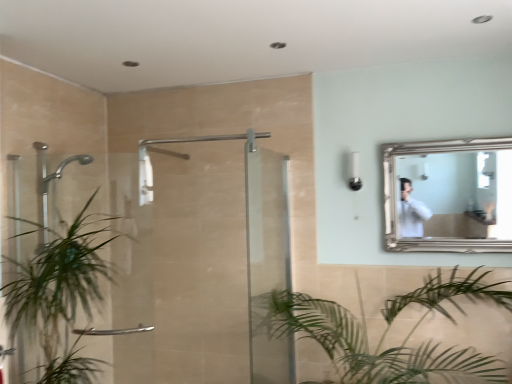
Question: Which direction should I rotate to look at green leafy plant at lower center, the 1th houseplant viewed from the right?

Choices:
 (A) right
 (B) left

Answer: (A)

Question: Is clear glass shower door at left, placed as the 1th screen door when sorted from left to right, closer to the viewer compared to silver/golden frame mirror at upper right?

Choices:
 (A) yes
 (B) no

Answer: (A)

Question: From the image's perspective, is clear glass shower door at left, placed as the 1th screen door when sorted from left to right, over silver/golden frame mirror at upper right?

Choices:
 (A) yes
 (B) no

Answer: (B)

Question: Is clear glass shower door at left, acting as the 2th screen door starting from the right, positioned behind silver/golden frame mirror at upper right?

Choices:
 (A) yes
 (B) no

Answer: (B)

Question: Is clear glass shower door at left, acting as the 2th screen door starting from the right, at the right side of silver/golden frame mirror at upper right?

Choices:
 (A) no
 (B) yes

Answer: (A)

Question: From the image's perspective, would you say clear glass shower door at left, placed as the 1th screen door when sorted from left to right, is shown under silver/golden frame mirror at upper right?

Choices:
 (A) yes
 (B) no

Answer: (A)

Question: Is clear glass shower door at left, acting as the 2th screen door starting from the right, thinner than silver/golden frame mirror at upper right?

Choices:
 (A) yes
 (B) no

Answer: (B)

Question: Considering the relative sizes of green leafy plant at lower center, the 1th houseplant viewed from the right, and green leafy plant at left, which ranks as the 1th houseplant in left-to-right order, in the image provided, is green leafy plant at lower center, the 1th houseplant viewed from the right, taller than green leafy plant at left, which ranks as the 1th houseplant in left-to-right order,?

Choices:
 (A) yes
 (B) no

Answer: (B)

Question: Can you confirm if green leafy plant at lower center, the 1th houseplant viewed from the right, is wider than green leafy plant at left, which ranks as the 1th houseplant in left-to-right order?

Choices:
 (A) no
 (B) yes

Answer: (B)

Question: Is green leafy plant at lower center, the 1th houseplant viewed from the right, in front of green leafy plant at left, placed as the second houseplant when sorted from right to left?

Choices:
 (A) no
 (B) yes

Answer: (B)

Question: From the image's perspective, would you say green leafy plant at lower center, the 1th houseplant viewed from the right, is shown under green leafy plant at left, placed as the second houseplant when sorted from right to left?

Choices:
 (A) no
 (B) yes

Answer: (B)

Question: From the image's perspective, would you say green leafy plant at lower center, marked as the 2th houseplant in a left-to-right arrangement, is positioned over green leafy plant at left, placed as the second houseplant when sorted from right to left?

Choices:
 (A) no
 (B) yes

Answer: (A)

Question: Considering the relative sizes of green leafy plant at lower center, marked as the 2th houseplant in a left-to-right arrangement, and green leafy plant at left, placed as the second houseplant when sorted from right to left, in the image provided, is green leafy plant at lower center, marked as the 2th houseplant in a left-to-right arrangement, thinner than green leafy plant at left, placed as the second houseplant when sorted from right to left,?

Choices:
 (A) no
 (B) yes

Answer: (A)

Question: From a real-world perspective, is white plastic light fixture at upper center under clear glass door at center, placed as the 1th screen door when sorted from right to left?

Choices:
 (A) no
 (B) yes

Answer: (A)